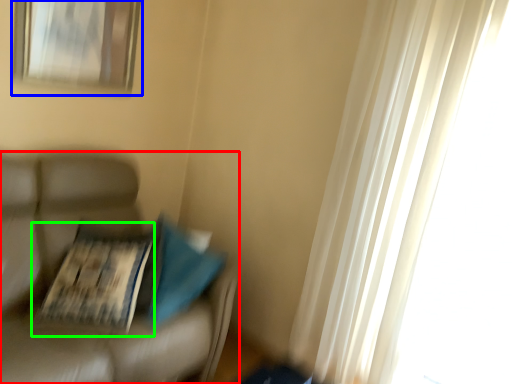
Question: Which object is positioned farthest from furniture (highlighted by a red box)? Select from picture frame (highlighted by a blue box) and magazine (highlighted by a green box).

Choices:
 (A) picture frame
 (B) magazine

Answer: (A)